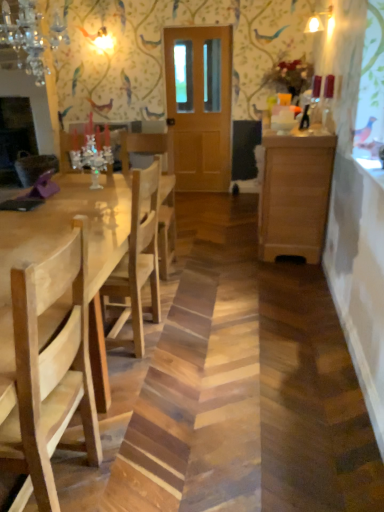
Question: Is wooden cabinet at right far away from crystal glass chandelier at upper left?

Choices:
 (A) no
 (B) yes

Answer: (B)

Question: From the image's perspective, is wooden cabinet at right below crystal glass chandelier at upper left?

Choices:
 (A) yes
 (B) no

Answer: (A)

Question: Is wooden cabinet at right behind crystal glass chandelier at upper left?

Choices:
 (A) yes
 (B) no

Answer: (A)

Question: From a real-world perspective, is wooden cabinet at right physically below crystal glass chandelier at upper left?

Choices:
 (A) yes
 (B) no

Answer: (A)

Question: Considering the relative sizes of wooden cabinet at right and crystal glass chandelier at upper left in the image provided, is wooden cabinet at right shorter than crystal glass chandelier at upper left?

Choices:
 (A) no
 (B) yes

Answer: (A)

Question: Is wooden cabinet at right next to crystal glass chandelier at upper left?

Choices:
 (A) yes
 (B) no

Answer: (B)

Question: Would you say wooden door at center is part of wooden cabinet at right's contents?

Choices:
 (A) yes
 (B) no

Answer: (B)

Question: Is wooden cabinet at right in contact with wooden door at center?

Choices:
 (A) yes
 (B) no

Answer: (B)

Question: Can you confirm if wooden cabinet at right is wider than wooden door at center?

Choices:
 (A) yes
 (B) no

Answer: (A)

Question: Considering the relative positions of wooden cabinet at right and wooden door at center in the image provided, is wooden cabinet at right behind wooden door at center?

Choices:
 (A) no
 (B) yes

Answer: (A)

Question: Considering the relative sizes of wooden cabinet at right and wooden door at center in the image provided, is wooden cabinet at right taller than wooden door at center?

Choices:
 (A) no
 (B) yes

Answer: (A)

Question: Is wooden cabinet at right bigger than wooden door at center?

Choices:
 (A) no
 (B) yes

Answer: (B)

Question: Is natural wood table at left closer to camera compared to wooden cabinet at right?

Choices:
 (A) yes
 (B) no

Answer: (A)